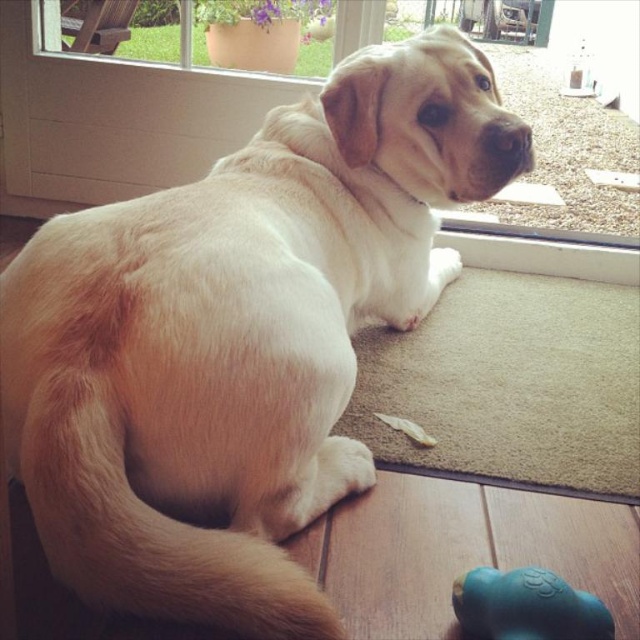
You are a delivery person trying to locate the transparent glass window at upper center. According to the coordinates provided, where exactly should you look?

The transparent glass window at upper center is located at the coordinates point (124,104).

In the scene shown: You are a dog owner who wants to ensure your dog stays safe indoors. You see the transparent glass window at upper center and the teal rubber dog toy at lower right. Which object is located higher up in the image?

The transparent glass window at upper center is positioned over the teal rubber dog toy at lower right, so it is higher up in the image.